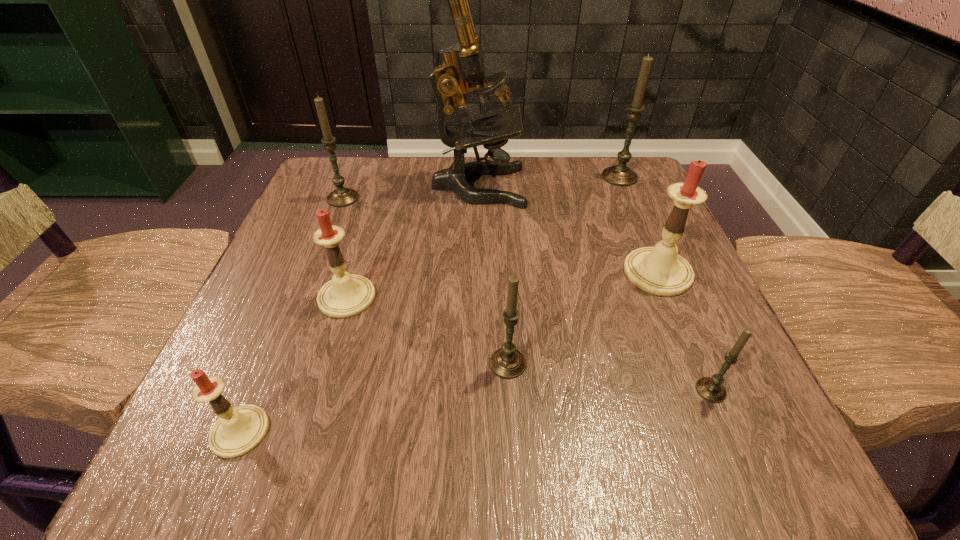
Locate an element on the screen. This screenshot has height=540, width=960. free point between the tallest object and the second smallest red candle is located at coordinates (413, 242).

The image size is (960, 540). Find the location of `vacant space that is in between the second biggest gray candle and the fourth candle from right to left`. vacant space that is in between the second biggest gray candle and the fourth candle from right to left is located at coordinates (425, 281).

Where is `free point between the second gray candle from left to right and the sixth nearest candle`? free point between the second gray candle from left to right and the sixth nearest candle is located at coordinates (425, 281).

At what (x,y) coordinates should I click in order to perform the action: click on free space between the sixth nearest candle and the third gray candle from right to left. Please return your answer as a coordinate pair (x, y). Looking at the image, I should click on (425, 281).

At what (x,y) coordinates should I click in order to perform the action: click on blank region between the second gray candle from left to right and the seventh shortest object. Please return your answer as a coordinate pair (x, y). This screenshot has width=960, height=540. Looking at the image, I should click on (564, 270).

Find the location of a particular element. The width and height of the screenshot is (960, 540). vacant space that is in between the fourth candle from left to right and the farthest candle is located at coordinates (564, 270).

Locate an element on the screen. This screenshot has width=960, height=540. vacant area between the tallest object and the second farthest candle is located at coordinates (411, 192).

The height and width of the screenshot is (540, 960). I want to click on vacant point located between the third smallest gray candle and the tallest object, so click(411, 192).

At what (x,y) coordinates should I click in order to perform the action: click on free point between the smallest gray candle and the nearest object. Please return your answer as a coordinate pair (x, y). Looking at the image, I should click on (475, 411).

This screenshot has height=540, width=960. Find the location of `vacant area that lies between the smallest red candle and the smallest gray candle`. vacant area that lies between the smallest red candle and the smallest gray candle is located at coordinates (475, 411).